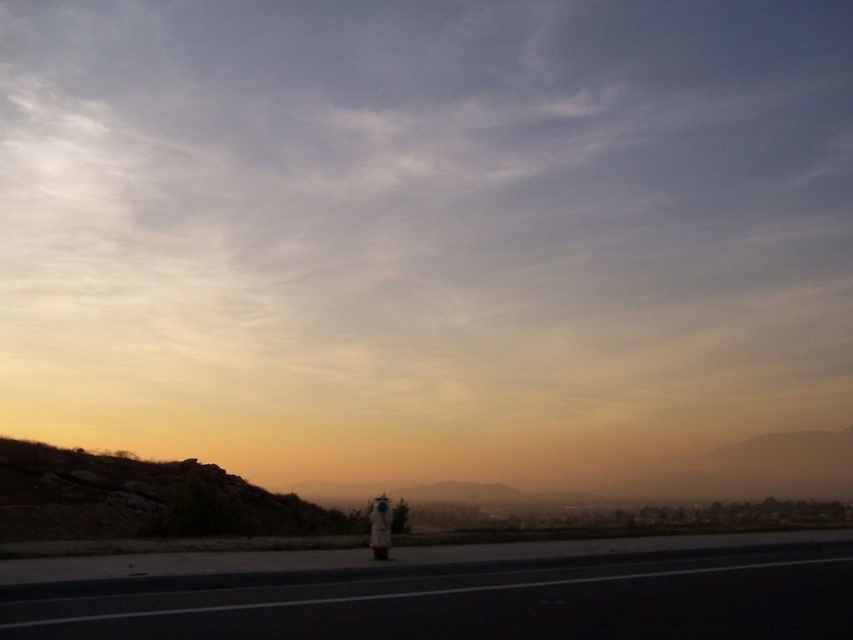
Question: Does black asphalt highway at lower center have a larger size compared to dull brown rock at lower left?

Choices:
 (A) yes
 (B) no

Answer: (B)

Question: Can you confirm if dull brown rock at lower left is wider than white fabric person at lower center?

Choices:
 (A) no
 (B) yes

Answer: (B)

Question: Among these points, which one is farthest from the camera?

Choices:
 (A) (375, 532)
 (B) (265, 596)

Answer: (A)

Question: Does black asphalt highway at lower center have a larger size compared to white fabric person at lower center?

Choices:
 (A) no
 (B) yes

Answer: (B)

Question: Which point is closer to the camera?

Choices:
 (A) (389, 531)
 (B) (122, 620)
 (C) (105, 484)

Answer: (B)

Question: Which point is closer to the camera?

Choices:
 (A) dull brown rock at lower left
 (B) black asphalt highway at lower center
 (C) white fabric person at lower center

Answer: (B)